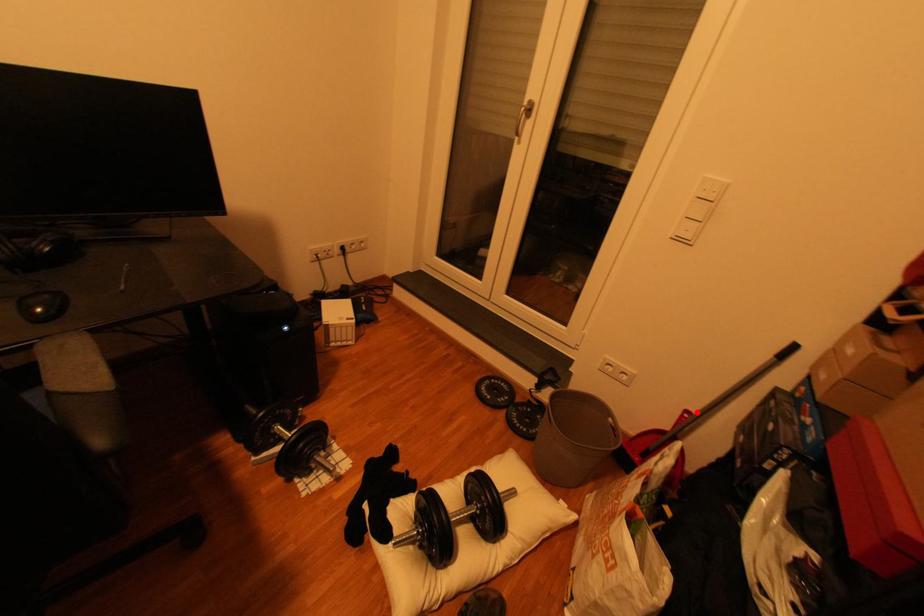
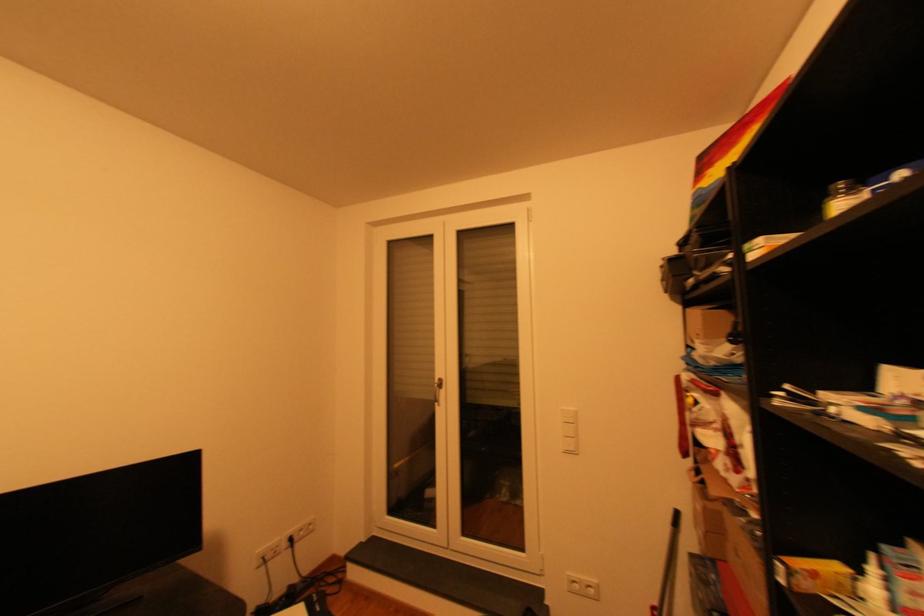
Question: I am providing you with two images of the same scene from different viewpoints. Image1 has a red point marked. In image2, the corresponding 3D location appears at what relative position? Reply with the corresponding letter.

Choices:
 (A) Closer
 (B) Farther

Answer: (B)